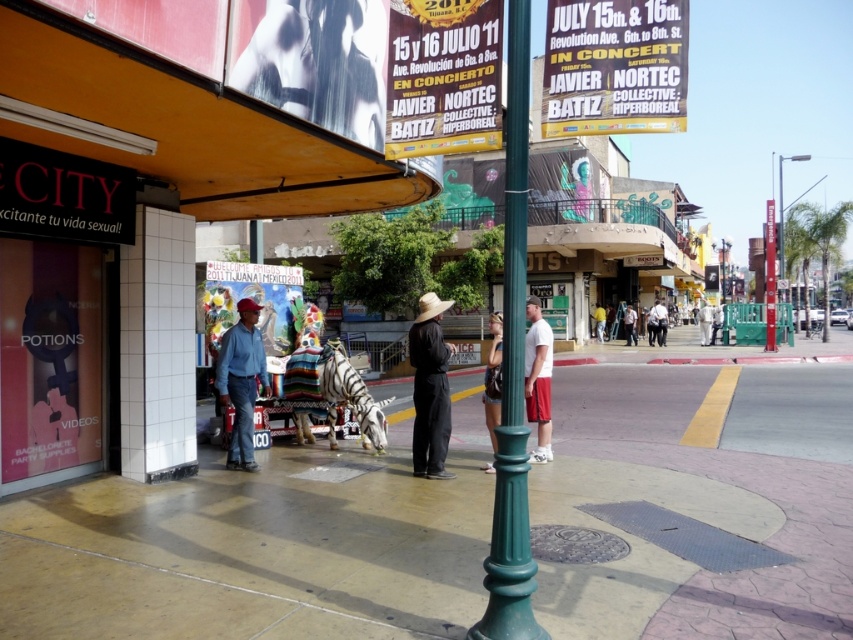
Question: Can you confirm if yellow paper poster at upper center is positioned below white fabric pants at center?

Choices:
 (A) no
 (B) yes

Answer: (A)

Question: Which point appears closest to the camera in this image?

Choices:
 (A) (722, 317)
 (B) (780, 202)
 (C) (436, 404)

Answer: (C)

Question: Which point is closer to the camera taking this photo?

Choices:
 (A) [x=685, y=3]
 (B) [x=61, y=317]
 (C) [x=399, y=522]
 (D) [x=718, y=307]

Answer: (A)

Question: Which object is positioned closest to the white cotton t-shirt at center?

Choices:
 (A) metallic pole at upper right
 (B) white cotton shirt at center
 (C) matte black shorts at center

Answer: (B)

Question: Considering the relative positions of matte paper poster at upper right and denim shirt at center in the image provided, where is matte paper poster at upper right located with respect to denim shirt at center?

Choices:
 (A) below
 (B) above

Answer: (B)

Question: Does matte black awning at upper left appear on the right side of matte black shorts at center?

Choices:
 (A) yes
 (B) no

Answer: (B)